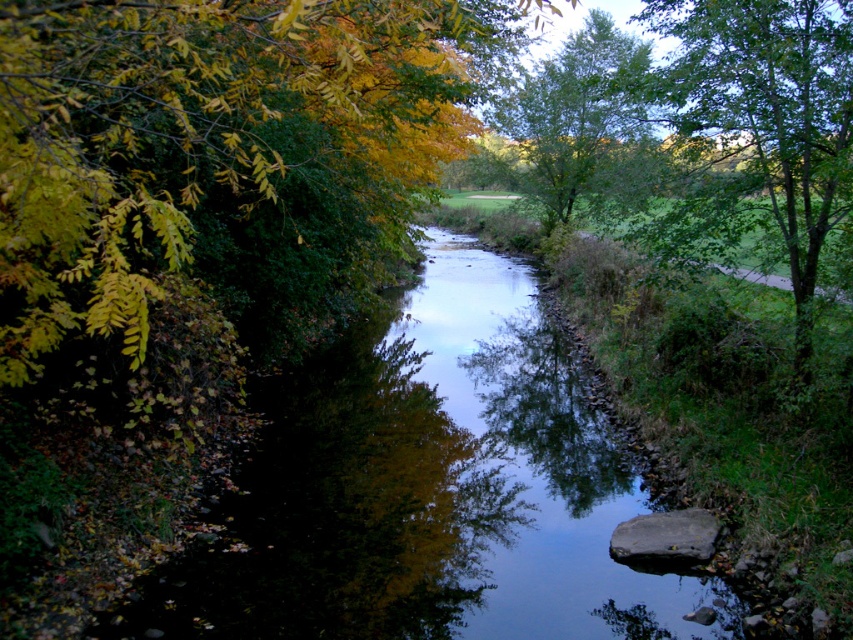
Question: Which of these objects is positioned closest to the green leafy tree at upper center?

Choices:
 (A) yellow-green leaves at upper left
 (B) green leafy tree at right

Answer: (B)

Question: Can you confirm if yellow-green leaves at upper left is smaller than green leafy tree at right?

Choices:
 (A) yes
 (B) no

Answer: (A)

Question: Observing the image, what is the correct spatial positioning of yellow-green leaves at upper left in reference to green leafy tree at right?

Choices:
 (A) below
 (B) above

Answer: (A)

Question: Among these points, which one is nearest to the camera?

Choices:
 (A) (651, 157)
 (B) (103, 93)
 (C) (769, 48)

Answer: (B)

Question: Is yellow-green leaves at upper left smaller than green leafy tree at right?

Choices:
 (A) yes
 (B) no

Answer: (A)

Question: Which of the following is the farthest from the observer?

Choices:
 (A) (802, 250)
 (B) (173, 272)

Answer: (A)